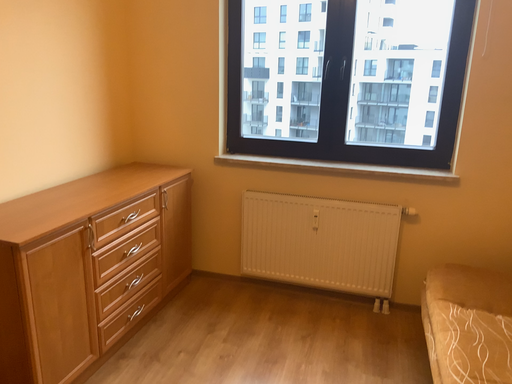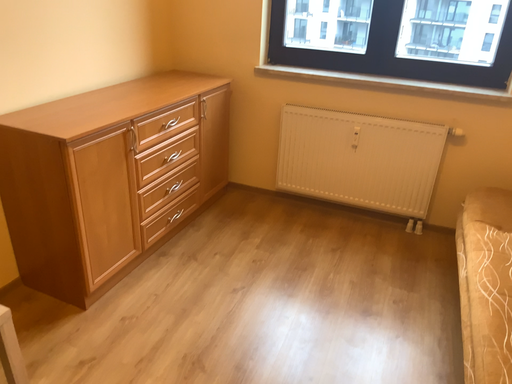
Question: Which way did the camera rotate in the video?

Choices:
 (A) rotated upward
 (B) rotated downward

Answer: (B)